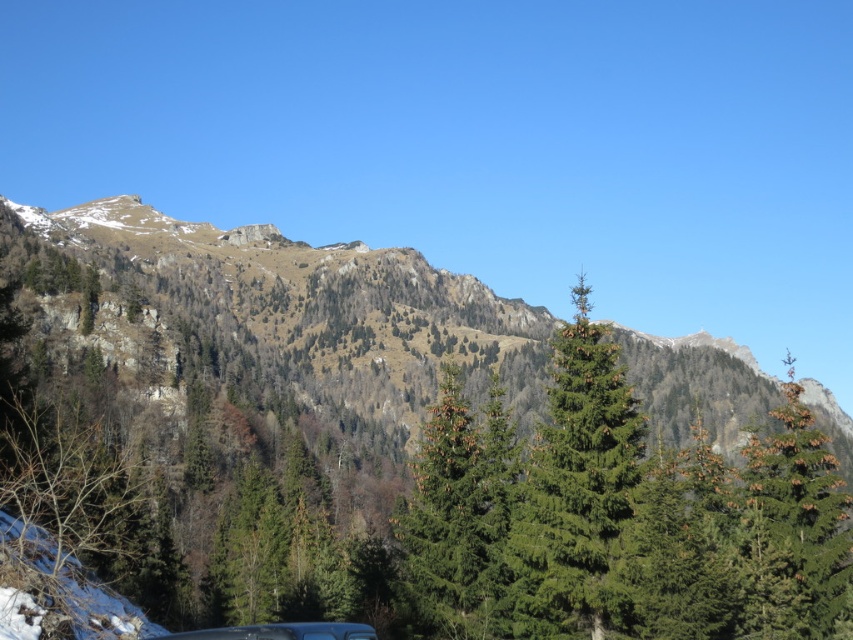
Is point (746, 394) behind point (544, 605)?

Yes, it is.

Is brown/dry grassy mountain at upper center to the right of green textured pine tree at center from the viewer's perspective?

Yes, brown/dry grassy mountain at upper center is to the right of green textured pine tree at center.

Where is `brown/dry grassy mountain at upper center`? brown/dry grassy mountain at upper center is located at coordinates (294, 307).

Identify the location of brown/dry grassy mountain at upper center. (294, 307).

Is point (628, 467) behind point (323, 632)?

That is True.

Which is more to the left, green textured pine tree at center or metallic silver car at lower center?

From the viewer's perspective, metallic silver car at lower center appears more on the left side.

Which is behind, point (606, 560) or point (351, 627)?

The point (606, 560) is more distant.

In order to click on green textured pine tree at center in this screenshot , I will do `click(573, 486)`.

Who is higher up, brown/dry grassy mountain at upper center or metallic silver car at lower center?

Positioned higher is brown/dry grassy mountain at upper center.

Is brown/dry grassy mountain at upper center thinner than metallic silver car at lower center?

No.

Between point (202, 316) and point (312, 624), which one is positioned behind?

The point (202, 316) is behind.

At what (x,y) coordinates should I click in order to perform the action: click on brown/dry grassy mountain at upper center. Please return your answer as a coordinate pair (x, y). Looking at the image, I should click on (294, 307).